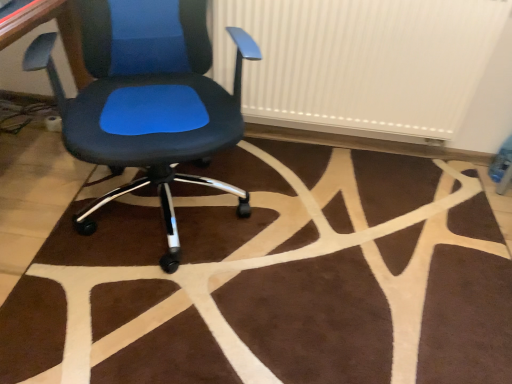
Question: Is white ribbed radiator at upper center next to matte black office chair at center and touching it?

Choices:
 (A) yes
 (B) no

Answer: (B)

Question: Is white ribbed radiator at upper center outside matte black office chair at center?

Choices:
 (A) yes
 (B) no

Answer: (A)

Question: Is white ribbed radiator at upper center facing towards matte black office chair at center?

Choices:
 (A) yes
 (B) no

Answer: (A)

Question: Is white ribbed radiator at upper center at the left side of matte black office chair at center?

Choices:
 (A) no
 (B) yes

Answer: (A)

Question: From a real-world perspective, is white ribbed radiator at upper center below matte black office chair at center?

Choices:
 (A) yes
 (B) no

Answer: (B)

Question: Is matte black office chair at center inside or outside of white ribbed radiator at upper center?

Choices:
 (A) outside
 (B) inside

Answer: (A)

Question: Is matte black office chair at center to the left or to the right of white ribbed radiator at upper center in the image?

Choices:
 (A) right
 (B) left

Answer: (B)

Question: Looking at the image, does matte black office chair at center seem bigger or smaller compared to white ribbed radiator at upper center?

Choices:
 (A) big
 (B) small

Answer: (A)

Question: Is matte black office chair at center taller or shorter than white ribbed radiator at upper center?

Choices:
 (A) short
 (B) tall

Answer: (B)

Question: Considering their positions, is white ribbed radiator at upper center located in front of or behind brown plush rug at center?

Choices:
 (A) front
 (B) behind

Answer: (B)

Question: From a real-world perspective, is white ribbed radiator at upper center above or below brown plush rug at center?

Choices:
 (A) below
 (B) above

Answer: (B)

Question: From the image's perspective, is white ribbed radiator at upper center located above or below brown plush rug at center?

Choices:
 (A) above
 (B) below

Answer: (A)

Question: Is white ribbed radiator at upper center inside or outside of brown plush rug at center?

Choices:
 (A) inside
 (B) outside

Answer: (B)

Question: Based on their sizes in the image, would you say brown plush rug at center is bigger or smaller than white ribbed radiator at upper center?

Choices:
 (A) big
 (B) small

Answer: (B)

Question: In the image, is brown plush rug at center on the left side or the right side of white ribbed radiator at upper center?

Choices:
 (A) right
 (B) left

Answer: (B)